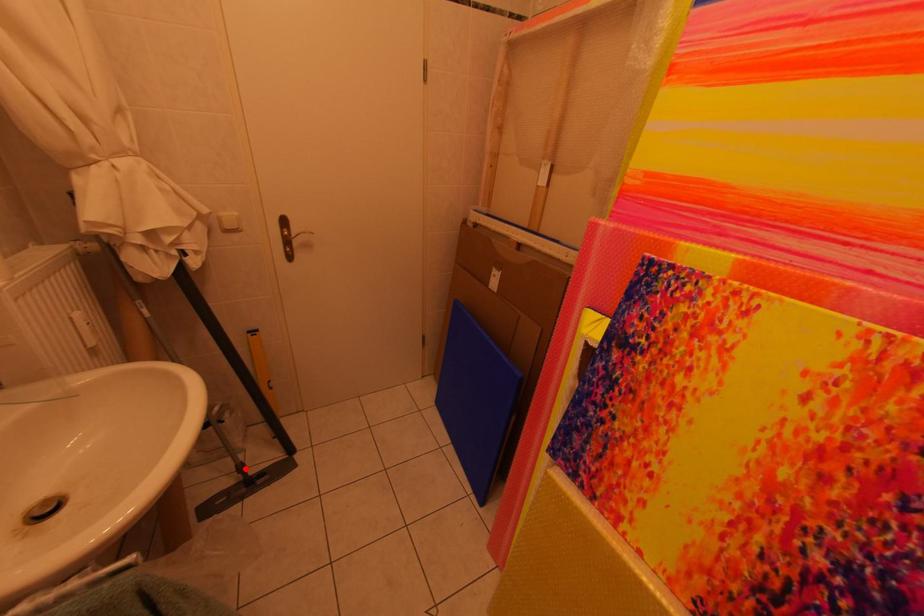
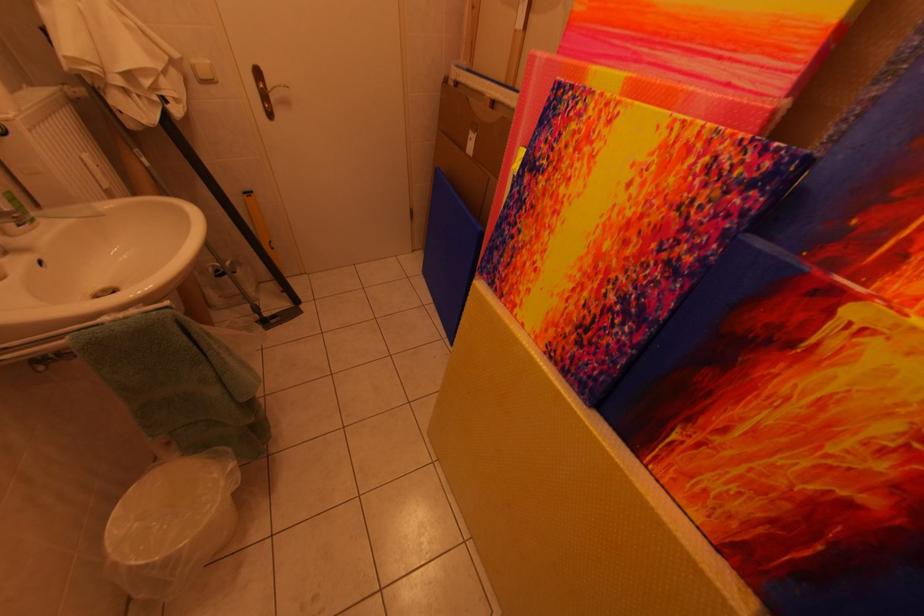
Question: I am providing you with two images of the same scene from different viewpoints. A red point is shown in image1. For the corresponding object point in image2, is it positioned nearer or farther from the camera?

Choices:
 (A) Nearer
 (B) Farther

Answer: (A)